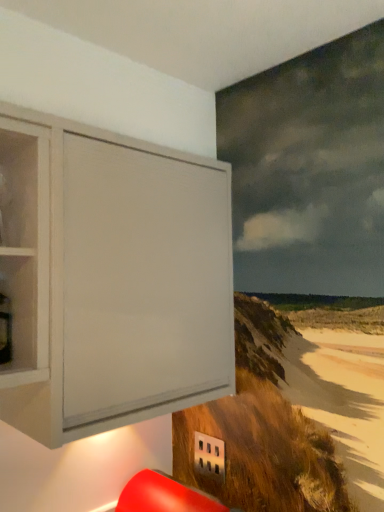
In order to face white plastic outlet at lower center, should I rotate leftwards or rightwards?

Rotate your view right by about 2.094°.

Locate an element on the screen. Image resolution: width=384 pixels, height=512 pixels. white plastic outlet at lower center is located at coordinates 209,456.

What do you see at coordinates (209, 456) in the screenshot?
I see `white plastic outlet at lower center` at bounding box center [209, 456].

What are the coordinates of `white plastic outlet at lower center` in the screenshot? It's located at (209, 456).